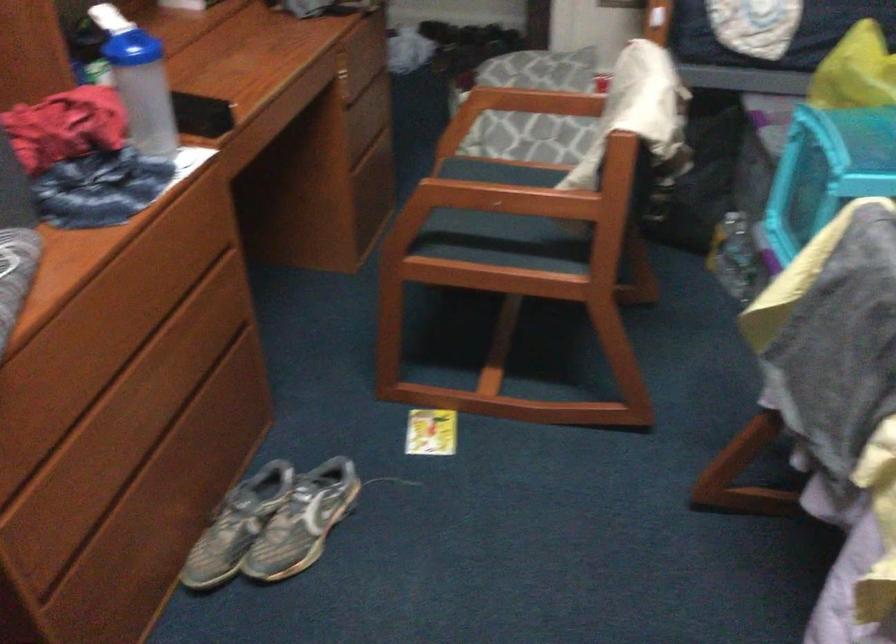
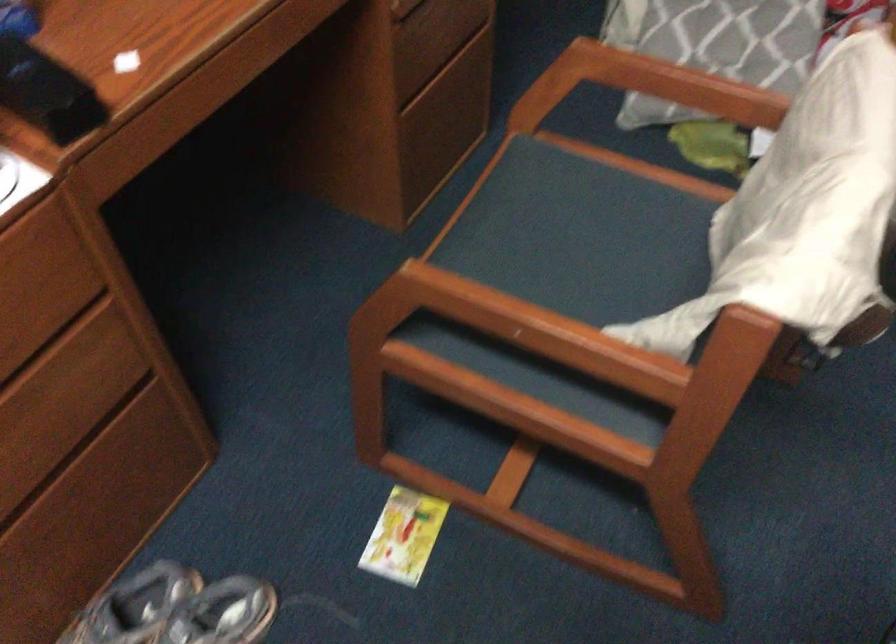
Question: The images are taken continuously from a first-person perspective. In which direction are you moving?

Choices:
 (A) Left
 (B) Right
 (C) Forward
 (D) Backward

Answer: (C)